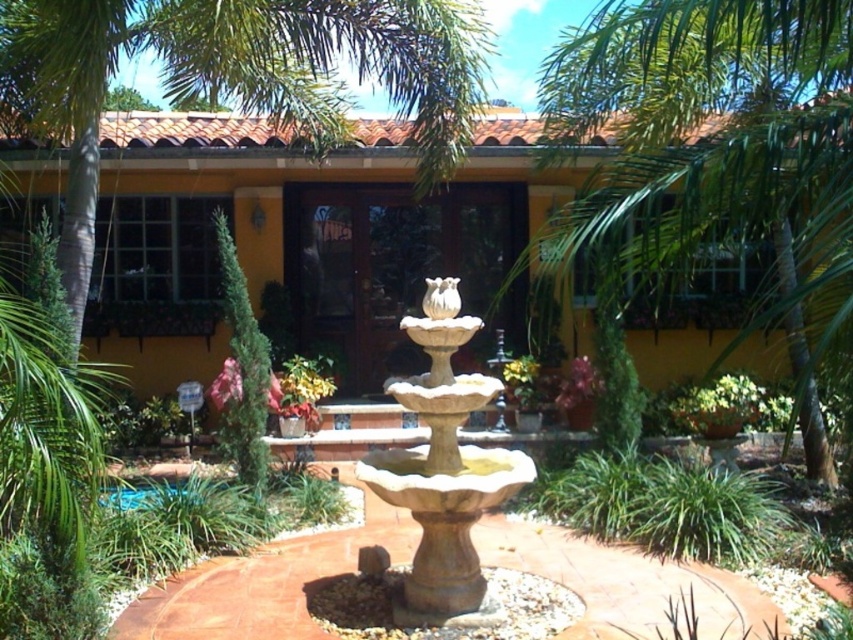
Question: Among these objects, which one is farthest from the camera?

Choices:
 (A) green leafy palm tree at upper right
 (B) beige stone fountain at center

Answer: (B)

Question: From the image, what is the correct spatial relationship of green leafy palm tree at upper right in relation to beige stone fountain at center?

Choices:
 (A) left
 (B) right

Answer: (B)

Question: Does green leafy palm tree at upper right appear under beige stone fountain at center?

Choices:
 (A) no
 (B) yes

Answer: (A)

Question: Can you confirm if green leafy palm tree at upper right is bigger than beige stone fountain at center?

Choices:
 (A) yes
 (B) no

Answer: (A)